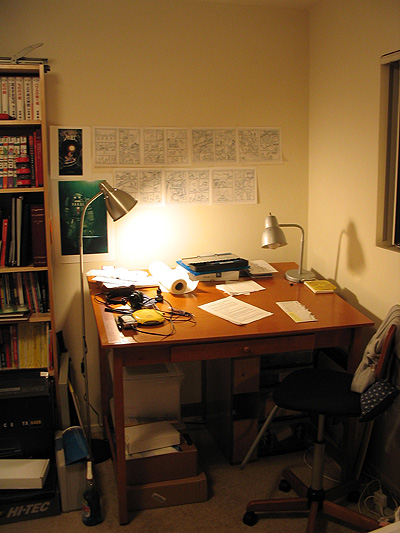
At what (x,y) coordinates should I click in order to perform the action: click on reflection of light on wall. Please return your answer as a coordinate pair (x, y). This screenshot has height=533, width=400. Looking at the image, I should click on (155, 230).